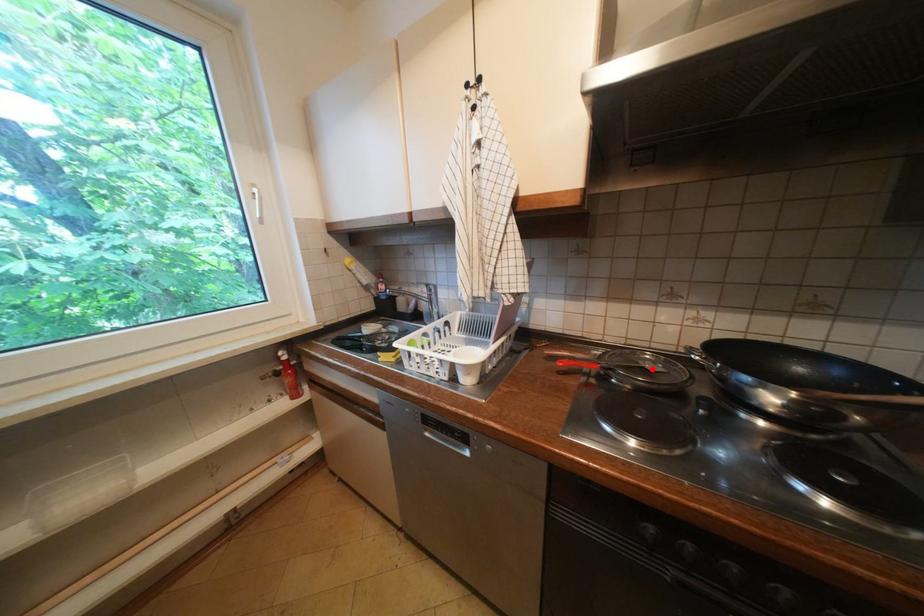
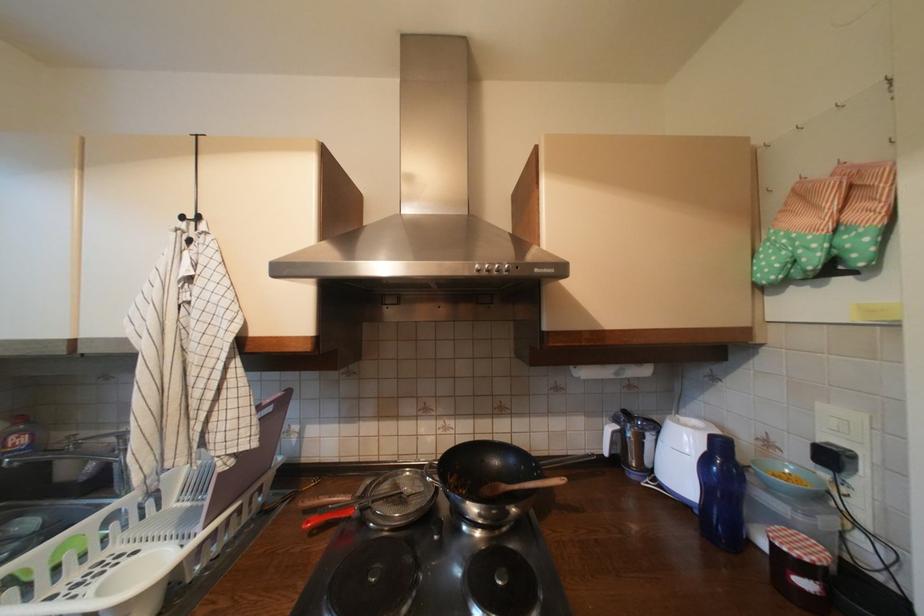
Where in the second image is the point corresponding to the highlighted location from the first image?

(410, 495)